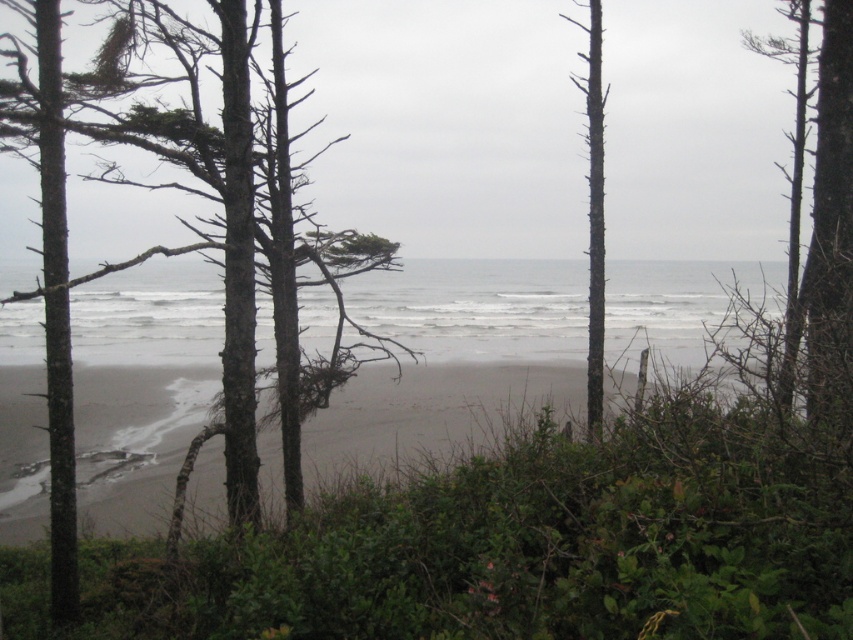
You are standing on the beach and want to take a photo of the smooth gray bark tree at center. If your camera has a maximum zoom range of 20 feet, will you need to move closer to capture the tree in focus without zooming?

The smooth gray bark tree at center is 21.69 feet away from the viewer. Since the camera can only zoom up to 20 feet, you need to move closer to ensure the tree is in focus without relying on zoom.

Based on the photo, you are standing at the point marked as point (430, 410). What is the type of the ground you are currently standing on?

The ground at point (430, 410) is gray sand at center.

You are a photographer planning to capture the coastal scene through the frame formed by the smooth bark tree at right and the gray sand at center. Which element takes up more visual space in the composition?

The smooth bark tree at right occupies more visual space than the gray sand at center according to the description.